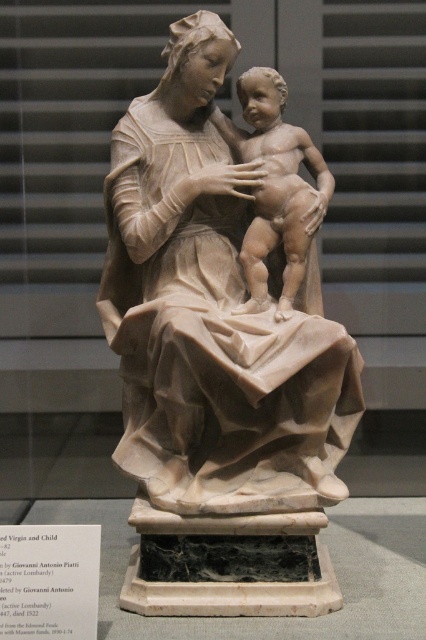
You are an art conservator examining the marble sculpture of the Virgin Mary and baby Jesus. You notice a specific point marked at coordinates (215, 365). Based on the scene description, where is this point located in relation to the statue?

The point at (215, 365) indicates the location of the white marble statue at center.

You are an art conservator examining the marble sculpture of the Virgin Mary and baby Jesus. You notice two points on the statue marked at coordinates point (183, 468) and point (298, 184). Which of these points is nearer to your viewpoint as you look at the sculpture?

Point (183, 468) is closer to the camera than point (298, 184), so the point at (183, 468) is nearer to your viewpoint.

You are an art conservator examining the statue of the Virgin Mary and baby Jesus. You need to place a protective barrier between the white marble statue at center and the matte beige baby at center. Based on their positions, which object should the barrier be closer to?

The white marble statue at center is to the left of matte beige baby at center, so the barrier should be placed closer to the white marble statue at center since it is positioned to the left of the baby.